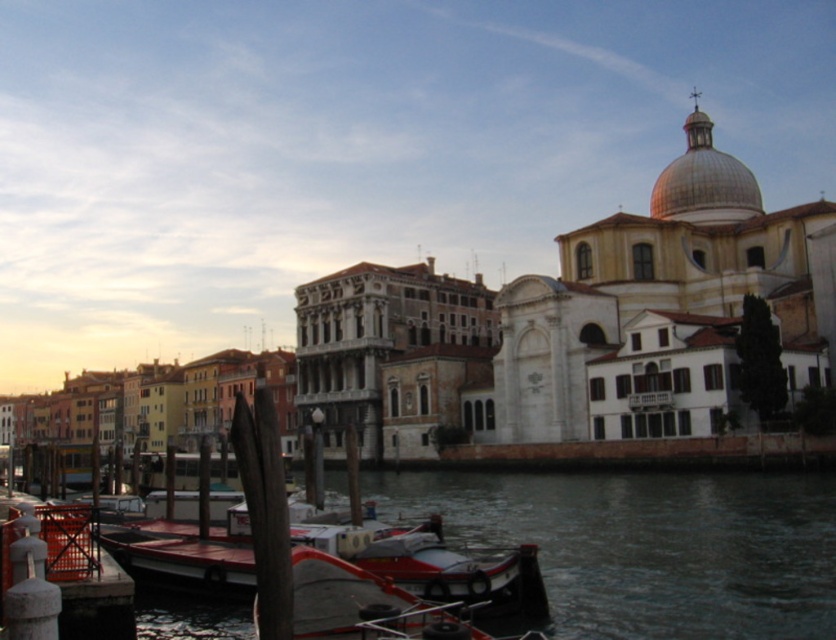
Question: Which object is the closest to the orange plastic dock at lower left?

Choices:
 (A) smooth concrete canal at lower center
 (B) white glossy boat at lower center

Answer: (B)

Question: Does white glossy boat at lower center appear on the right side of orange plastic dock at lower left?

Choices:
 (A) no
 (B) yes

Answer: (B)

Question: Can you confirm if white glossy boat at lower center is positioned below orange plastic dock at lower left?

Choices:
 (A) yes
 (B) no

Answer: (A)

Question: Which point is closer to the camera?

Choices:
 (A) (394, 630)
 (B) (29, 497)
 (C) (665, 547)

Answer: (A)

Question: Can you confirm if smooth concrete canal at lower center is thinner than white glossy boat at lower center?

Choices:
 (A) yes
 (B) no

Answer: (B)

Question: Which of the following is the closest to the observer?

Choices:
 (A) (692, 616)
 (B) (106, 628)
 (C) (350, 632)

Answer: (B)